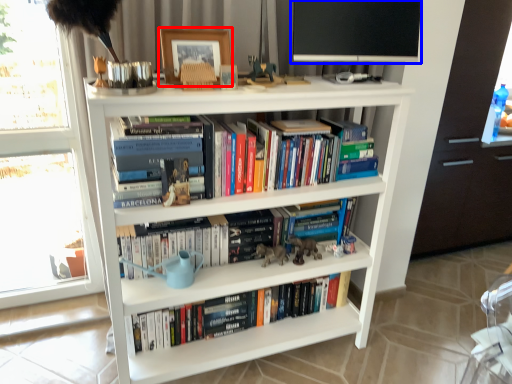
Question: Which point is further to the camera, picture frame (highlighted by a red box) or computer monitor (highlighted by a blue box)?

Choices:
 (A) picture frame
 (B) computer monitor

Answer: (B)